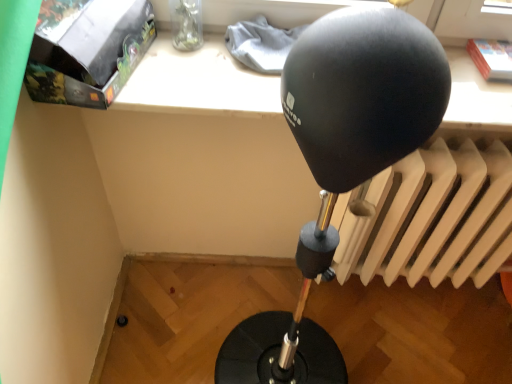
Question: Is matte black box at upper left inside the boundaries of white matte radiator at right, or outside?

Choices:
 (A) outside
 (B) inside

Answer: (A)

Question: Is point (129, 41) closer or farther from the camera than point (480, 168)?

Choices:
 (A) farther
 (B) closer

Answer: (B)

Question: From a real-world perspective, is matte black box at upper left above or below white matte radiator at right?

Choices:
 (A) below
 (B) above

Answer: (B)

Question: Based on their sizes in the image, would you say white matte radiator at right is bigger or smaller than matte black box at upper left?

Choices:
 (A) big
 (B) small

Answer: (A)

Question: Is white matte radiator at right inside the boundaries of matte black box at upper left, or outside?

Choices:
 (A) outside
 (B) inside

Answer: (A)

Question: Looking at their shapes, would you say white matte radiator at right is wider or thinner than matte black box at upper left?

Choices:
 (A) wide
 (B) thin

Answer: (B)

Question: From the image's perspective, relative to matte black box at upper left, is white matte radiator at right above or below?

Choices:
 (A) above
 (B) below

Answer: (B)